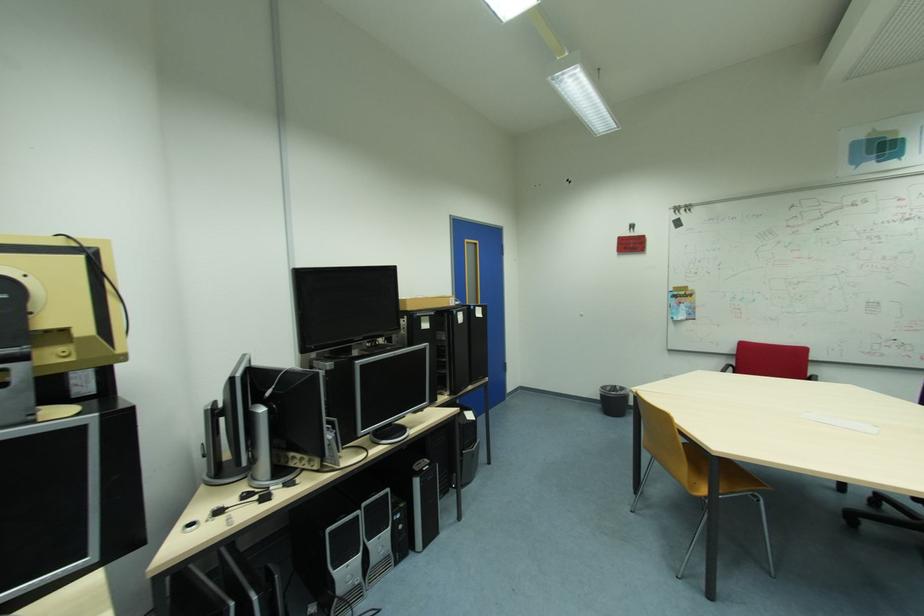
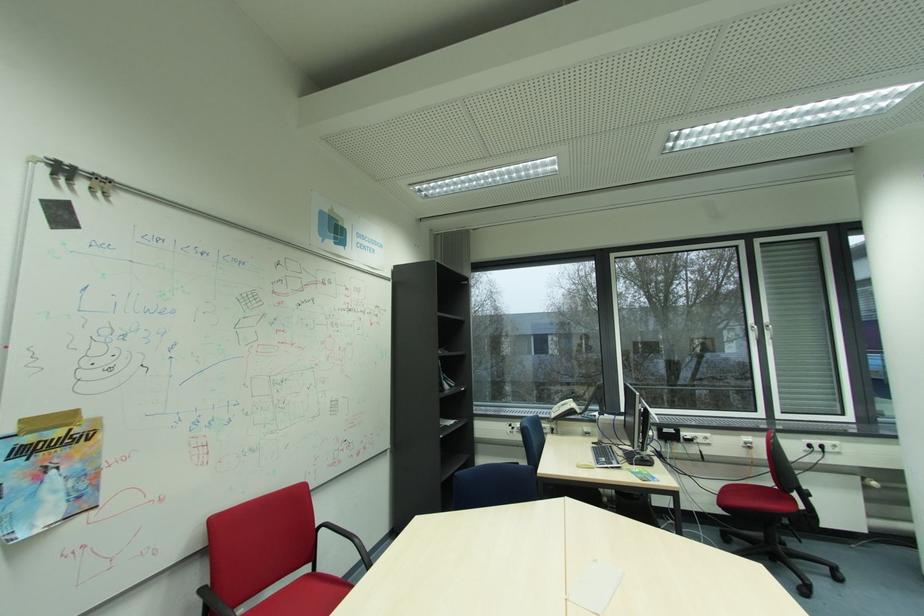
In the second image, find the point that corresponds to the point at 682,297 in the first image.

(31, 452)